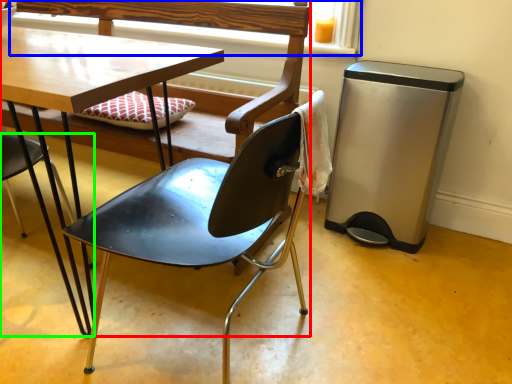
Question: Estimate the real-world distances between objects in this image. Which object is farther from chair (highlighted by a red box), window frame (highlighted by a blue box) or chair (highlighted by a green box)?

Choices:
 (A) window frame
 (B) chair

Answer: (A)